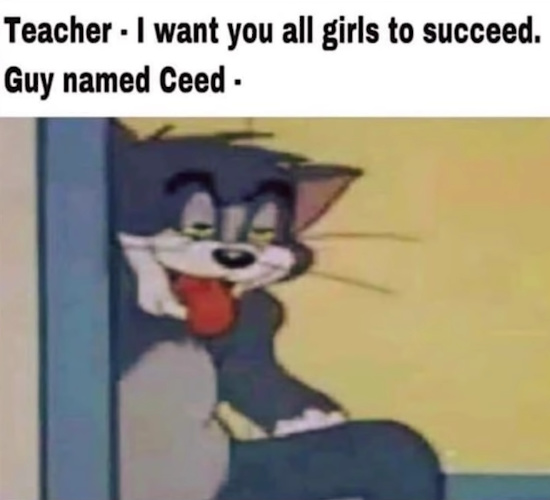
This screenshot has height=500, width=550. Identify the location of blue-gray doorway. (74, 292).